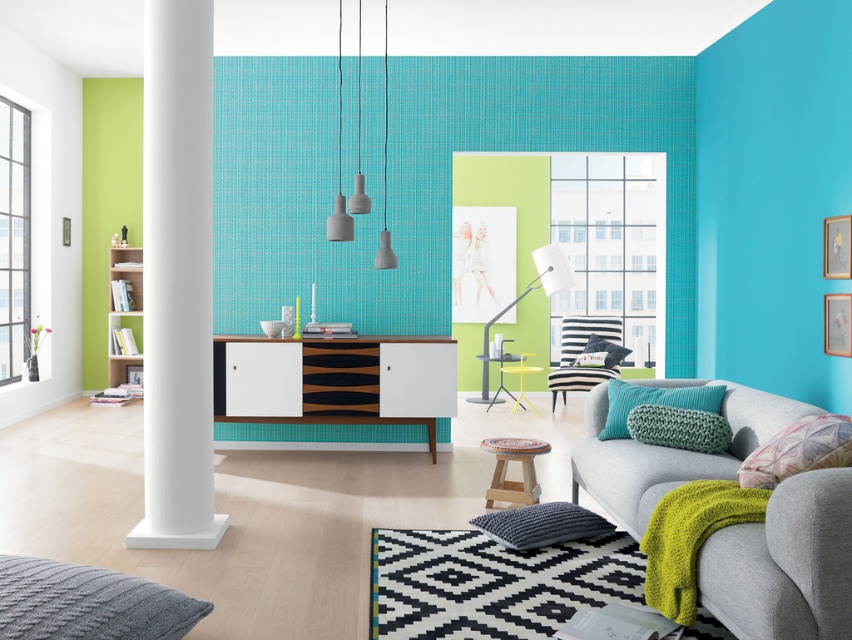
Is point (200, 333) positioned after point (688, 419)?

Yes.

Does white smooth column at left have a lesser height compared to green knitted pillow at lower right?

In fact, white smooth column at left may be taller than green knitted pillow at lower right.

Is point (159, 230) closer to camera compared to point (726, 448)?

That is False.

Identify the location of white smooth column at left. (177, 278).

Is wooden stool at center to the right of textured black pillow at center from the viewer's perspective?

In fact, wooden stool at center is to the left of textured black pillow at center.

You are a GUI agent. You are given a task and a screenshot of the screen. Output one action in this format:
    pyautogui.click(x=<x>, y=<y>)
    Task: Click on the wooden stool at center
    
    Given the screenshot: What is the action you would take?
    pyautogui.click(x=505, y=468)

At what (x,y) coordinates should I click in order to perform the action: click on wooden stool at center. Please return your answer as a coordinate pair (x, y). Image resolution: width=852 pixels, height=640 pixels. Looking at the image, I should click on (505, 468).

Which is in front, point (509, 481) or point (602, 353)?

Point (509, 481)

Is wooden stool at center to the right of teal fabric pillow at center from the viewer's perspective?

No, wooden stool at center is not to the right of teal fabric pillow at center.

You are a GUI agent. You are given a task and a screenshot of the screen. Output one action in this format:
    pyautogui.click(x=<x>, y=<y>)
    Task: Click on the wooden stool at center
    The image size is (852, 640).
    Given the screenshot: What is the action you would take?
    pyautogui.click(x=505, y=468)

Image resolution: width=852 pixels, height=640 pixels. Identify the location of wooden stool at center. (505, 468).